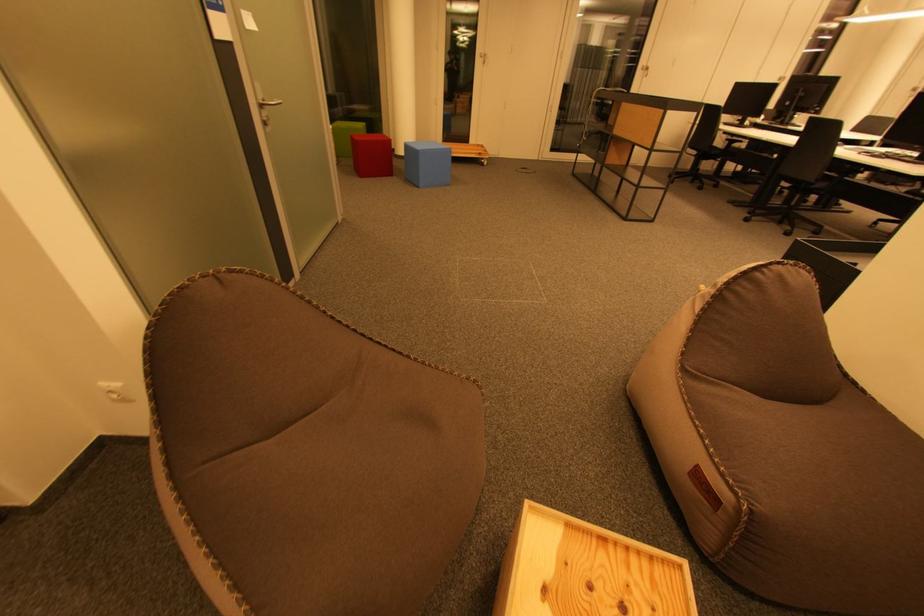
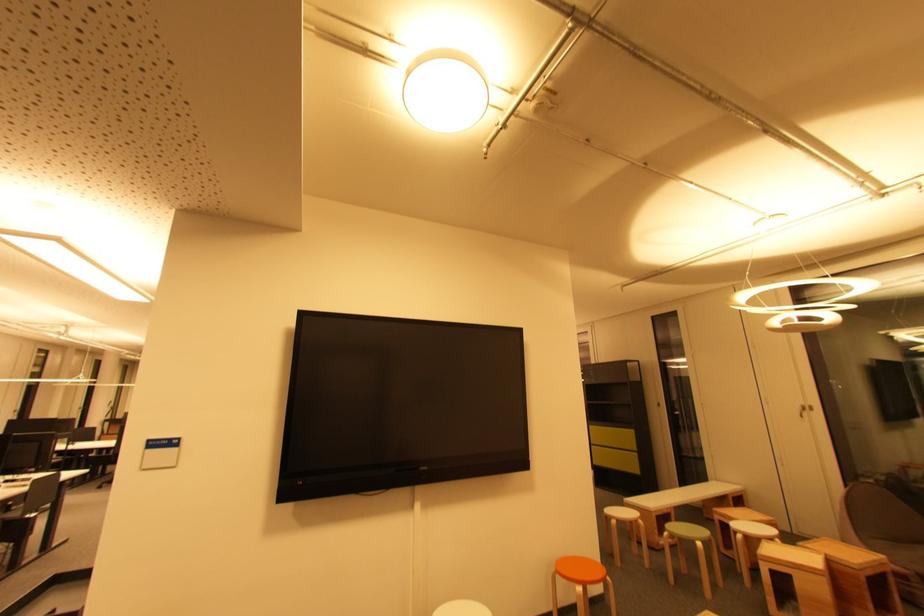
Question: The camera is either moving clockwise (left) or counter-clockwise (right) around the object. The first image is from the beginning of the video and the second image is from the end. Is the camera moving left or right when shooting the video?

Choices:
 (A) Left
 (B) Right

Answer: (A)